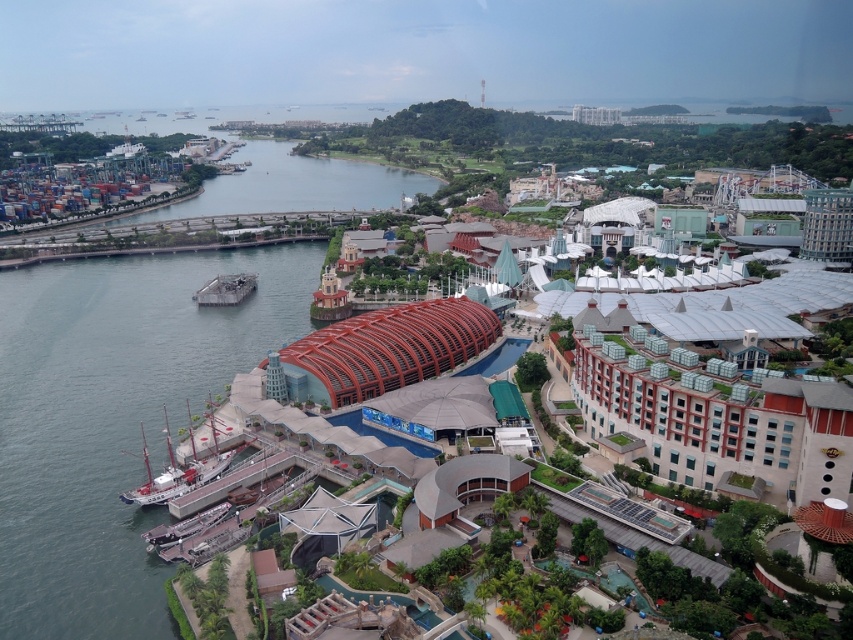
Question: Can you confirm if gray concrete water at left is smaller than wooden ship at lower left?

Choices:
 (A) yes
 (B) no

Answer: (B)

Question: Which object appears closest to the camera in this image?

Choices:
 (A) gray concrete water at left
 (B) wooden ship at lower left

Answer: (A)

Question: Is gray concrete water at left in front of wooden ship at lower left?

Choices:
 (A) no
 (B) yes

Answer: (B)

Question: Does gray concrete water at left appear under wooden ship at lower left?

Choices:
 (A) no
 (B) yes

Answer: (A)